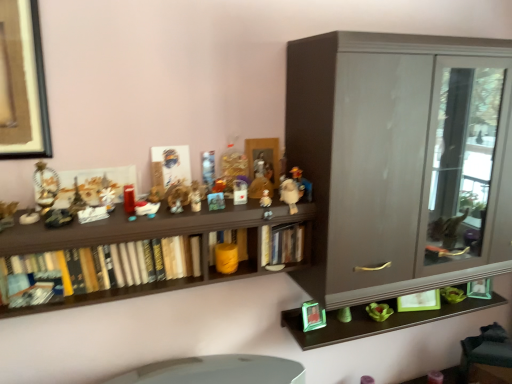
Question: Is point (230, 230) closer or farther from the camera than point (108, 208)?

Choices:
 (A) closer
 (B) farther

Answer: (B)

Question: From a real-world perspective, relative to metallic silver toy at center, positioned as the second toy in left-to-right order, is yellow matte bookshelf at center, which is the 2th book from right to left, vertically above or below?

Choices:
 (A) above
 (B) below

Answer: (B)

Question: Which of these objects is positioned farthest from the matte gray cabinet at right?

Choices:
 (A) metallic silver toy at center, the 7th toy viewed from the right
 (B) hardcover books at center left, the 3th book from the right
 (C) green plastic frame at lower right, the 11th toy when ordered from left to right
 (D) matte plastic cup at center, which is counted as the third toy, starting from the left
 (E) white plastic toy at center, which ranks as the 9th toy in left-to-right order

Answer: (D)

Question: Which object is the closest to the green matte bowl at lower right, which is the 1th toy in right-to-left order?

Choices:
 (A) metallic silver toy at center, which is the sixth toy from left to right
 (B) matte plastic figurine at center, which is counted as the fourth toy, starting from the left
 (C) white plastic toy at center, marked as the 4th toy in a right-to-left arrangement
 (D) matte gray cabinet at right
 (E) brown wooden shelf at upper center

Answer: (D)